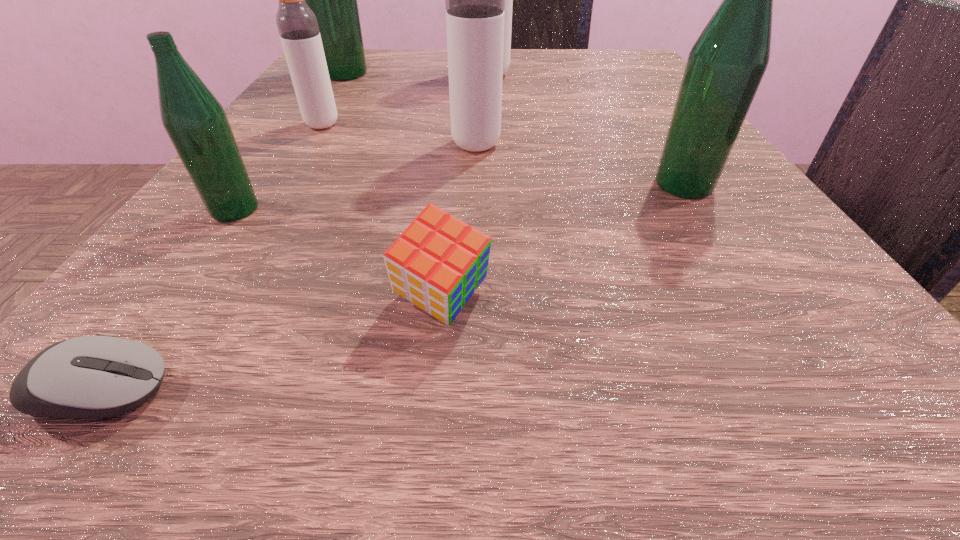
Identify the location of vacant space at the right edge of the desktop. The height and width of the screenshot is (540, 960). (672, 96).

You are a GUI agent. You are given a task and a screenshot of the screen. Output one action in this format:
    pyautogui.click(x=<x>, y=<y>)
    Task: Click on the free location at the far left corner
    
    Given the screenshot: What is the action you would take?
    pyautogui.click(x=384, y=75)

Find the location of `free space at the far right corner`. free space at the far right corner is located at coordinates (625, 86).

This screenshot has height=540, width=960. In order to click on free space at the near right corner of the desktop in this screenshot , I will do `click(897, 371)`.

This screenshot has width=960, height=540. Find the location of `empty space that is in between the farthest gray bottle and the cube`. empty space that is in between the farthest gray bottle and the cube is located at coordinates (465, 188).

You are a GUI agent. You are given a task and a screenshot of the screen. Output one action in this format:
    pyautogui.click(x=<x>, y=<y>)
    Task: Click on the blank region between the rightmost bottle and the second nearest gray bottle
    
    Given the screenshot: What is the action you would take?
    pyautogui.click(x=503, y=155)

Locate an element on the screen. This screenshot has width=960, height=540. free point between the nearest gray bottle and the rightmost green bottle is located at coordinates (580, 165).

Locate an element on the screen. The image size is (960, 540). empty space that is in between the biggest gray bottle and the farthest green bottle is located at coordinates (416, 75).

Find the location of a particular element. Image resolution: width=960 pixels, height=540 pixels. vacant area between the sixth nearest object and the rightmost green bottle is located at coordinates (503, 155).

You are a GUI agent. You are given a task and a screenshot of the screen. Output one action in this format:
    pyautogui.click(x=<x>, y=<y>)
    Task: Click on the free space between the smallest green bottle and the farthest green bottle
    The image size is (960, 540).
    Given the screenshot: What is the action you would take?
    pyautogui.click(x=290, y=141)